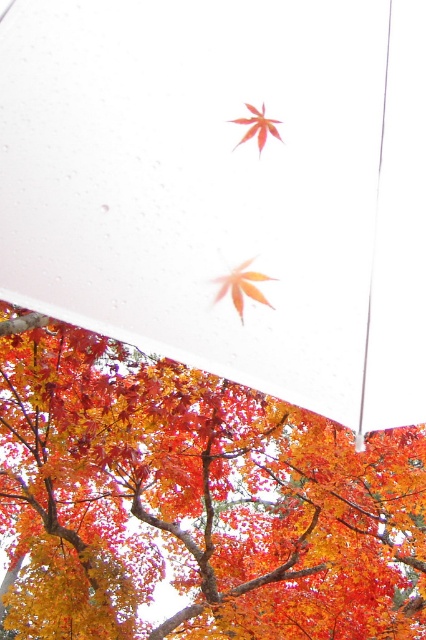
Question: Is shiny orange leaf at upper center to the right of shiny orange maple leaf at upper center from the viewer's perspective?

Choices:
 (A) no
 (B) yes

Answer: (A)

Question: Where is orange matte maple leaf at center located in relation to shiny orange maple leaf at upper center in the image?

Choices:
 (A) left
 (B) right

Answer: (A)

Question: Does shiny orange leaf at upper center have a lesser width compared to shiny orange maple leaf at upper center?

Choices:
 (A) no
 (B) yes

Answer: (A)

Question: Which point is farther to the camera?

Choices:
 (A) orange matte maple leaf at center
 (B) shiny orange maple leaf at upper center
 (C) transparent plastic canopy at center
 (D) shiny orange leaf at upper center

Answer: (D)

Question: Which object is farther from the camera taking this photo?

Choices:
 (A) orange matte maple leaf at center
 (B) shiny orange maple leaf at upper center
 (C) shiny orange leaf at upper center

Answer: (C)

Question: Among these points, which one is nearest to the camera?

Choices:
 (A) (264, 140)
 (B) (222, 288)
 (C) (45, 132)

Answer: (C)